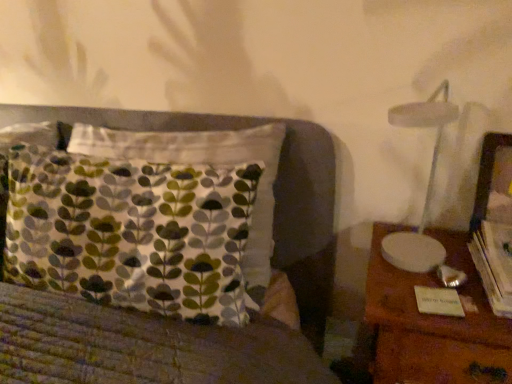
Identify the location of blank area to the left of hardcover book at right. Image resolution: width=512 pixels, height=384 pixels. (424, 283).